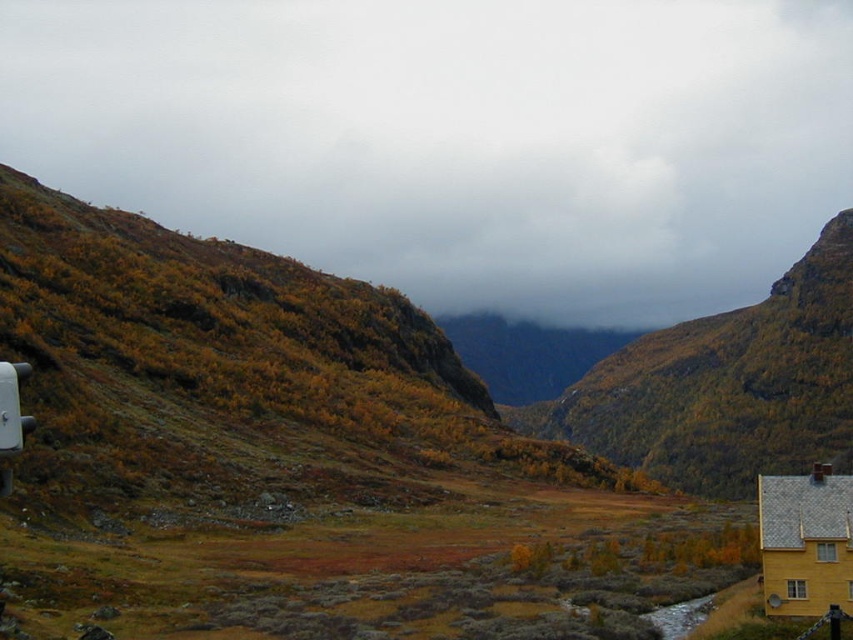
You are standing at the yellow building on the right side of the frame and want to walk towards the point with coordinates point [815,573] and point [13,424]. Which point is closer to you?

Point [13,424] is closer to you because it is closer to the camera than point [815,573].

Looking at this image, you are a hiker planning to set up a tent in this mountainous area. You need to ensure that your tent is placed in a location where it won, 1.5 meters away from the cloudy gray sky at upper center. Is this possible? Please explain your reasoning.

The cloudy gray sky at upper center is located at point (456, 138) in the image. Since the sky is an overhead feature, it is not possible to place the tent 1.5 meters away from it horizontally. The sky is above the entire landscape, so the tent will always be under the sky regardless of its position.

You are planning to take a photo of the yellow wooden house at lower right and the white plastic recreational vehicle at left. Since you want both objects to be clearly visible in the frame, which one should you focus on first?

The white plastic recreational vehicle at left is behind the yellow wooden house at lower right, so you should focus on the yellow wooden house at lower right first to ensure both are in focus.